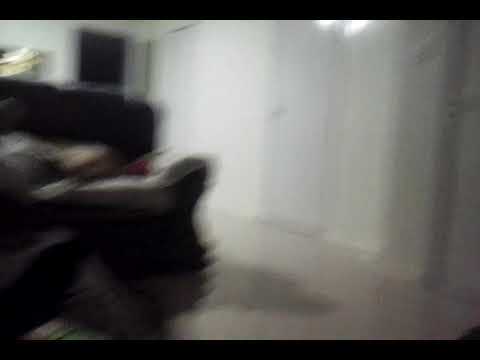
Identify the location of back of couch. The image size is (480, 360). (97, 110), (26, 98).